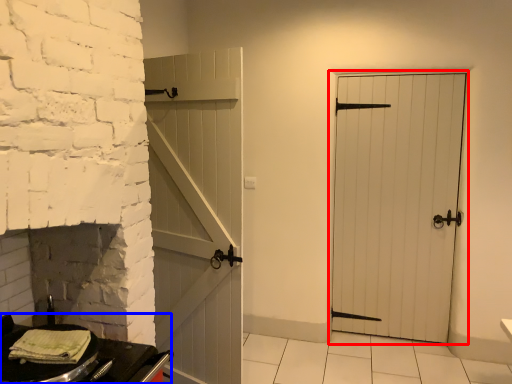
Question: Which point is closer to the camera, door (highlighted by a red box) or table (highlighted by a blue box)?

Choices:
 (A) door
 (B) table

Answer: (B)